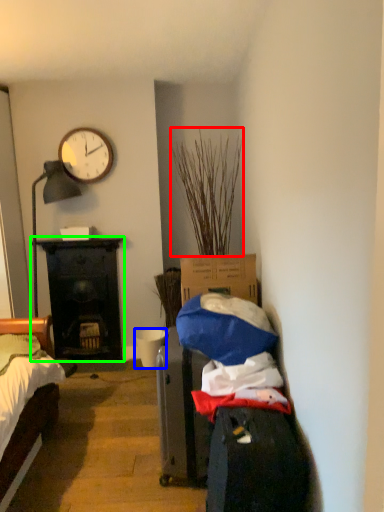
Question: Based on their relative distances, which object is farther from plant (highlighted by a red box)? Choose from bucket (highlighted by a blue box) and desk (highlighted by a green box).

Choices:
 (A) bucket
 (B) desk

Answer: (A)